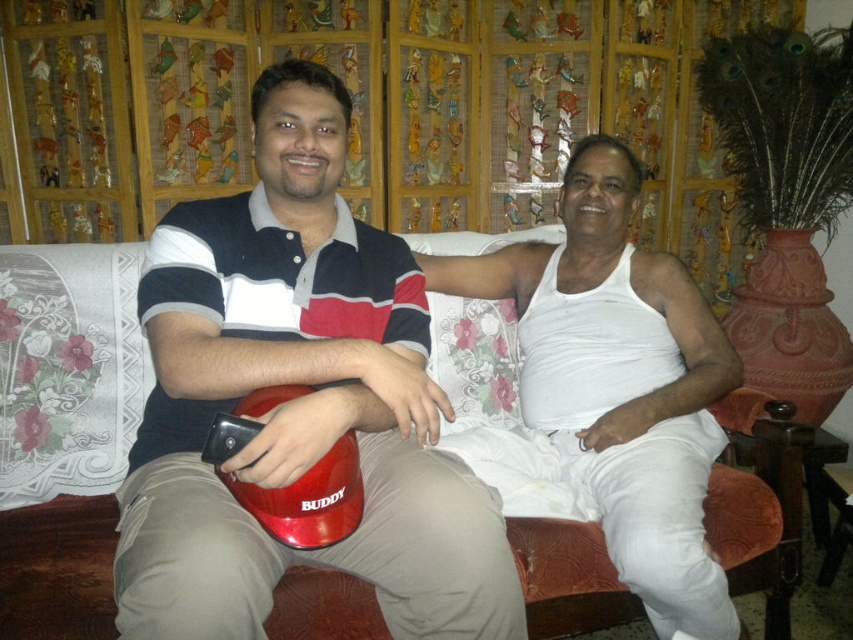
You are a delivery person who needs to place a small package on either the matte plastic helmet at center or the white cotton tank top at center. Which object should you choose to ensure the package stays visible from above?

The white cotton tank top at center is taller than the matte plastic helmet at center, so placing the package on the white cotton tank top at center would make it more visible from above.

You are a delivery person who needs to place a small package between the matte plastic helmet at center and the white cotton tank top at center. Can you fit it there?

The matte plastic helmet at center is positioned on the left side of white cotton tank top at center, so there is space between them to place the small package.